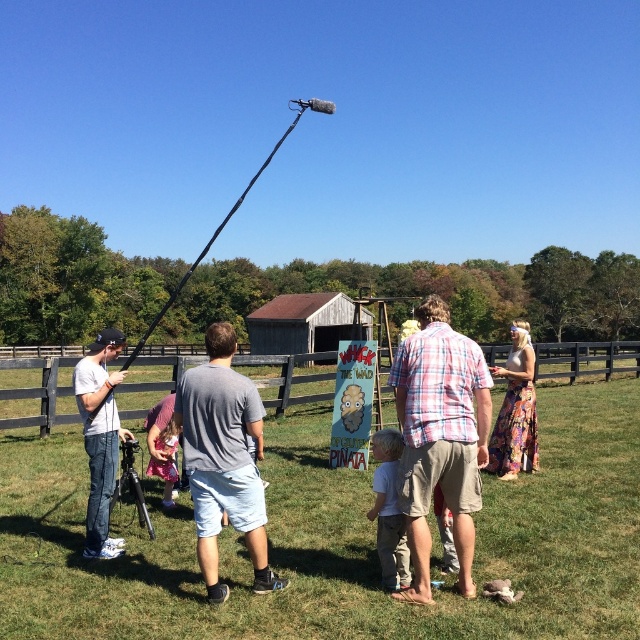
Question: Which of the following is the farthest from the observer?

Choices:
 (A) (252, 422)
 (B) (506, 371)
 (C) (417, 499)

Answer: (B)

Question: Which point is closer to the camera?

Choices:
 (A) (385, 429)
 (B) (16, 470)

Answer: (A)

Question: Does matte gray sign at center come behind denim jeans at left?

Choices:
 (A) yes
 (B) no

Answer: (B)

Question: Is brown wooden fence at center further to the viewer compared to light gray cotton shirt at center?

Choices:
 (A) yes
 (B) no

Answer: (A)

Question: Which of the following is the farthest from the observer?

Choices:
 (A) brown wooden fence at center
 (B) denim jeans at left
 (C) black matte tripod at lower left
 (D) gray cotton t-shirt at center

Answer: (A)

Question: Can you confirm if brown wooden fence at center is positioned to the right of denim jeans at left?

Choices:
 (A) no
 (B) yes

Answer: (B)